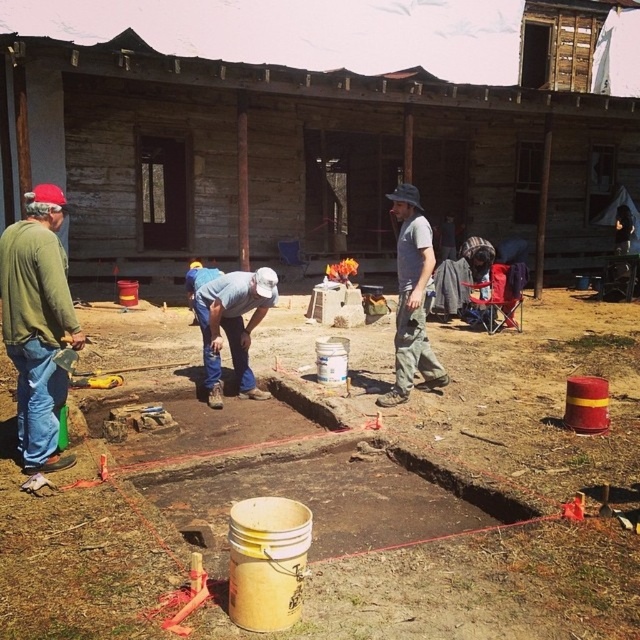
You are a safety inspector at the construction site. You notice two workers wearing green matte shirt at left and gray cotton shirt at center. According to safety protocols, workers must be at least 2 meters apart. Can you determine if they are following the safety guidelines based on their positions?

The green matte shirt at left is located below gray cotton shirt at center, but their horizontal distance isn not specified. Safety inspectors cannot confirm if they are 2 meters apart vertically or horizontally without more information.

You are a safety inspector at the construction site. You notice two workers wearing a gray cotton shirt at center and denim jeans at center. Which clothing item is more likely to be compliant with the safety standards based on their size?

The gray cotton shirt at center is larger in size than denim jeans at center, so it is more likely to be compliant with safety standards as proper fit is essential for safety gear.